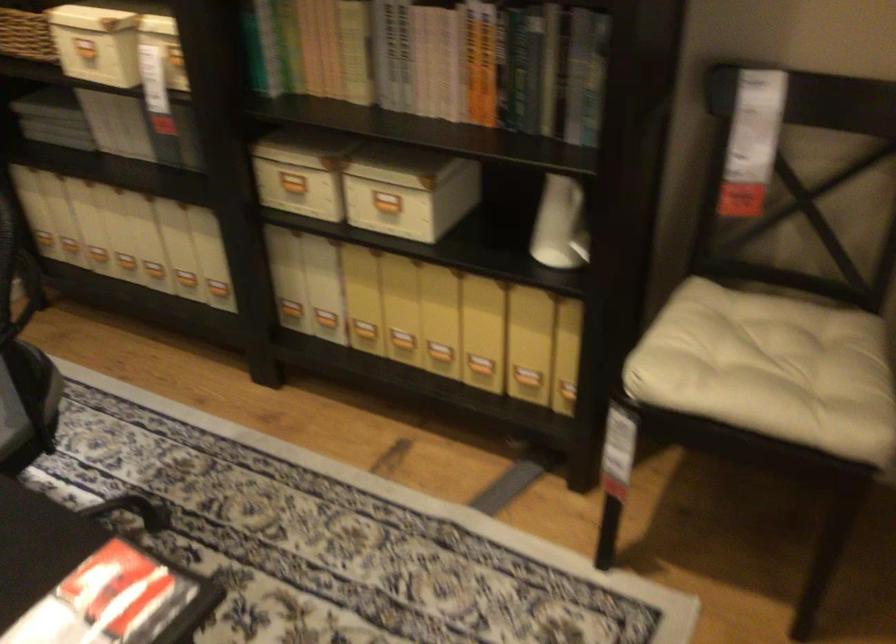
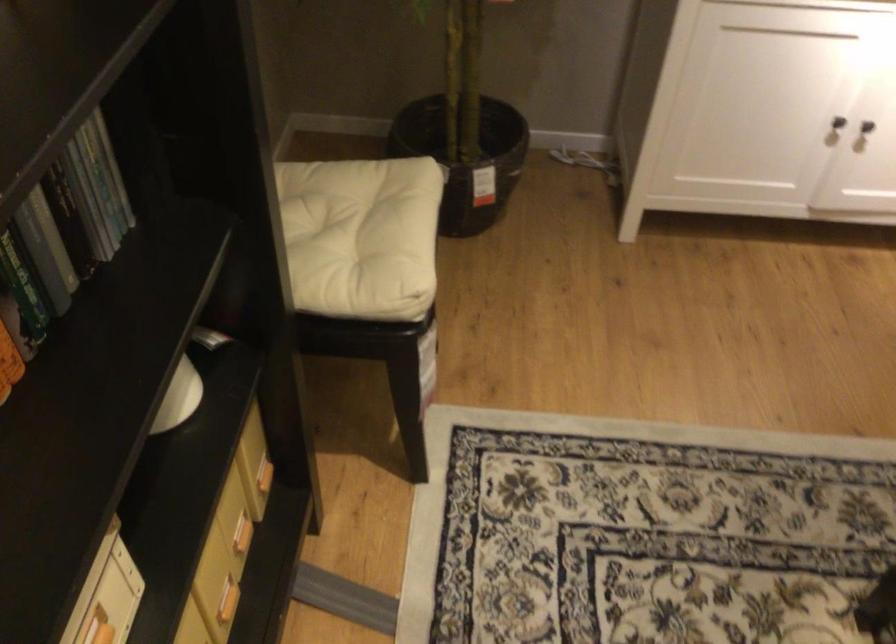
Locate, in the second image, the point that corresponds to (549,368) in the first image.

(240, 534)